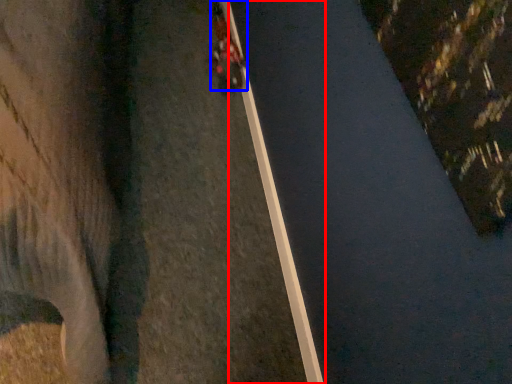
Question: Which point is further to the camera, curb (highlighted by a red box) or vehicle (highlighted by a blue box)?

Choices:
 (A) curb
 (B) vehicle

Answer: (B)